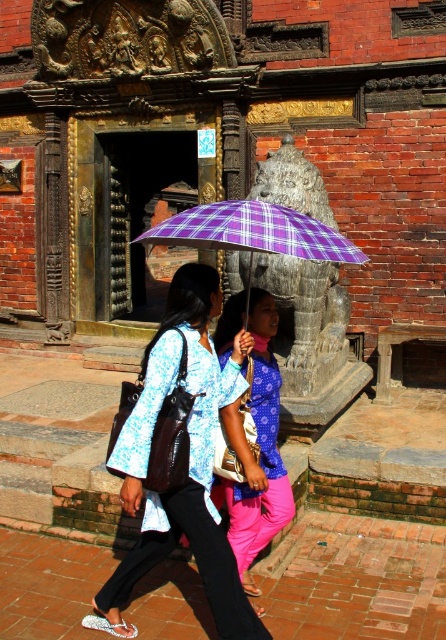
Question: Can you confirm if matte blue blouse at center is bigger than matte purple umbrella at center?

Choices:
 (A) no
 (B) yes

Answer: (B)

Question: Which point appears closest to the camera in this image?

Choices:
 (A) (285, 230)
 (B) (256, 355)
 (C) (203, 353)

Answer: (A)

Question: Which object is positioned closest to the matte purple umbrella at center?

Choices:
 (A) purple checkered umbrella at center
 (B) matte blue blouse at center

Answer: (B)

Question: In this image, where is matte blue blouse at center located relative to purple checkered umbrella at center?

Choices:
 (A) right
 (B) left

Answer: (B)

Question: Is matte blue blouse at center to the right of purple checkered umbrella at center from the viewer's perspective?

Choices:
 (A) yes
 (B) no

Answer: (B)

Question: Among these objects, which one is farthest from the camera?

Choices:
 (A) matte purple umbrella at center
 (B) purple checkered umbrella at center
 (C) matte blue blouse at center

Answer: (A)